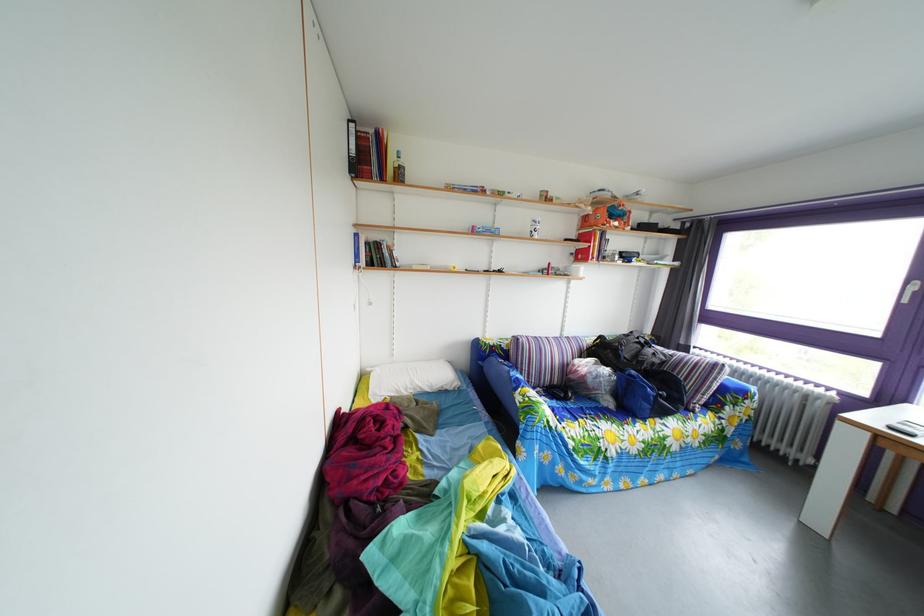
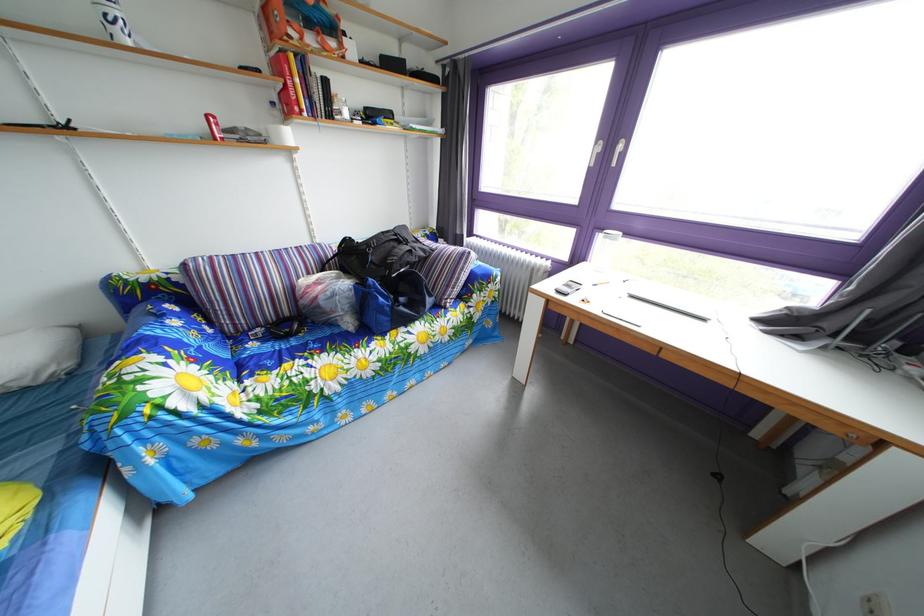
Find the pixel in the second image that matches pixel 664 362 in the first image.

(421, 260)